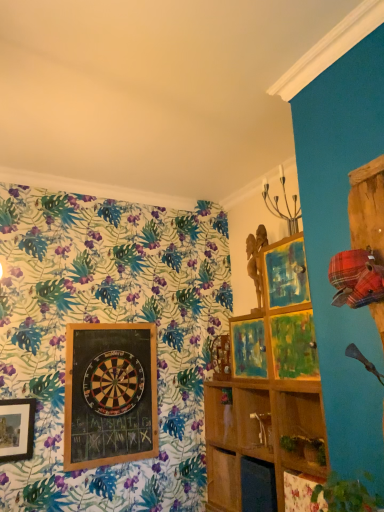
Question: Should I look upward or downward to see wooden shelf at center, arranged as the second shelf when viewed from the front?

Choices:
 (A) down
 (B) up

Answer: (A)

Question: Does wooden shelf at center, arranged as the first shelf when viewed from the front, have a greater height compared to wooden dartboard at center?

Choices:
 (A) yes
 (B) no

Answer: (B)

Question: Can you confirm if wooden shelf at center, arranged as the first shelf when viewed from the front, is shorter than wooden dartboard at center?

Choices:
 (A) yes
 (B) no

Answer: (A)

Question: Is wooden shelf at center, arranged as the first shelf when viewed from the front, positioned behind wooden dartboard at center?

Choices:
 (A) no
 (B) yes

Answer: (A)

Question: Would you say wooden shelf at center, which ranks as the second shelf in back-to-front order, is outside wooden dartboard at center?

Choices:
 (A) no
 (B) yes

Answer: (B)

Question: From the image's perspective, would you say wooden shelf at center, which ranks as the second shelf in back-to-front order, is shown under wooden dartboard at center?

Choices:
 (A) yes
 (B) no

Answer: (A)

Question: Is wooden shelf at center, which ranks as the second shelf in back-to-front order, aimed at wooden shelf at center, which is counted as the 1th shelf, starting from the back?

Choices:
 (A) yes
 (B) no

Answer: (A)

Question: Is wooden shelf at center, arranged as the first shelf when viewed from the front, further to camera compared to wooden shelf at center, arranged as the second shelf when viewed from the front?

Choices:
 (A) no
 (B) yes

Answer: (A)

Question: Is wooden shelf at center, arranged as the first shelf when viewed from the front, taller than wooden shelf at center, arranged as the second shelf when viewed from the front?

Choices:
 (A) yes
 (B) no

Answer: (A)

Question: Can you see wooden shelf at center, which ranks as the second shelf in back-to-front order, touching wooden shelf at center, which is counted as the 1th shelf, starting from the back?

Choices:
 (A) no
 (B) yes

Answer: (A)

Question: Can wooden shelf at center, which is counted as the 1th shelf, starting from the back, be found inside wooden shelf at center, which ranks as the second shelf in back-to-front order?

Choices:
 (A) yes
 (B) no

Answer: (A)

Question: Considering the relative sizes of wooden shelf at center, which ranks as the second shelf in back-to-front order, and wooden shelf at center, which is counted as the 1th shelf, starting from the back, in the image provided, is wooden shelf at center, which ranks as the second shelf in back-to-front order, shorter than wooden shelf at center, which is counted as the 1th shelf, starting from the back,?

Choices:
 (A) yes
 (B) no

Answer: (B)

Question: Could wooden dartboard at center be considered to be inside wooden shelf at center, arranged as the second shelf when viewed from the front?

Choices:
 (A) yes
 (B) no

Answer: (B)